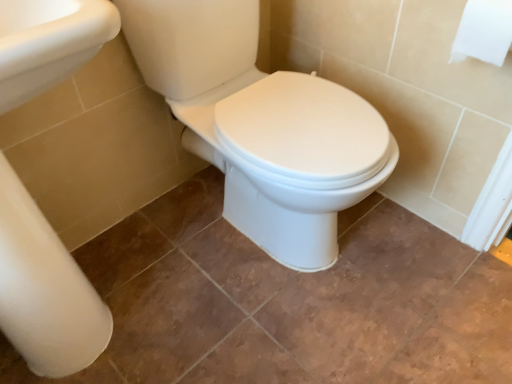
This screenshot has height=384, width=512. I want to click on free space in front of white glossy porcelain at center, so click(x=290, y=334).